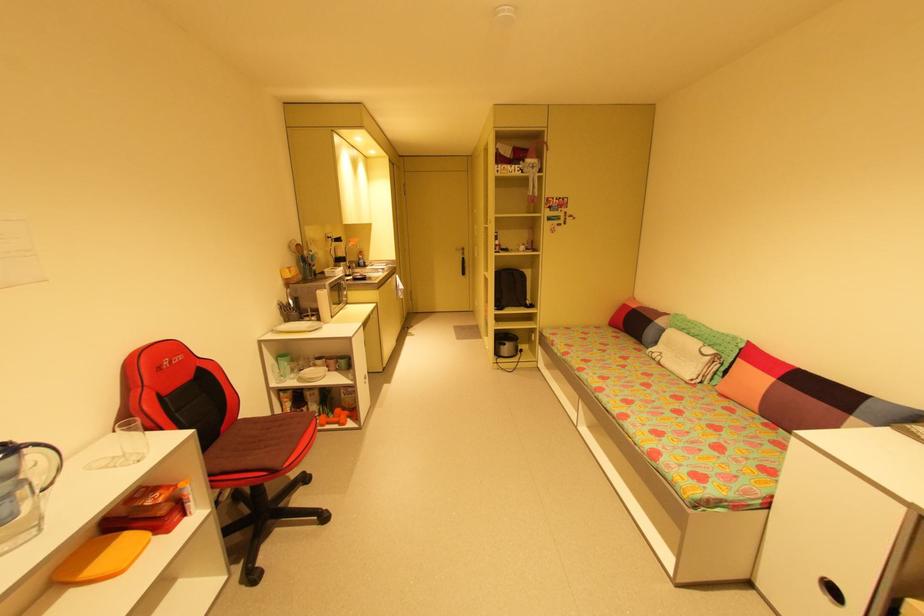
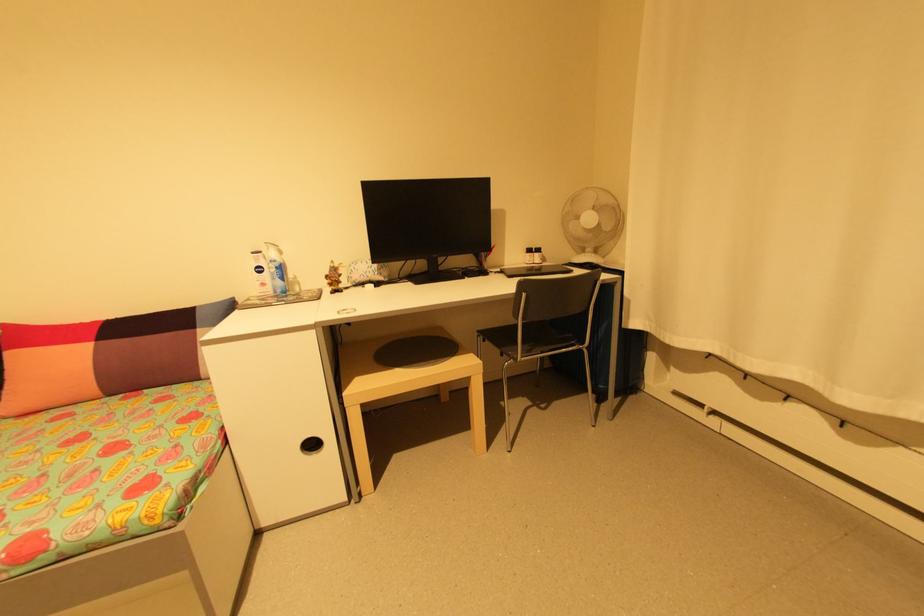
The images are taken continuously from a first-person perspective. In which direction is your viewpoint rotating?

The camera rotated toward right-down.